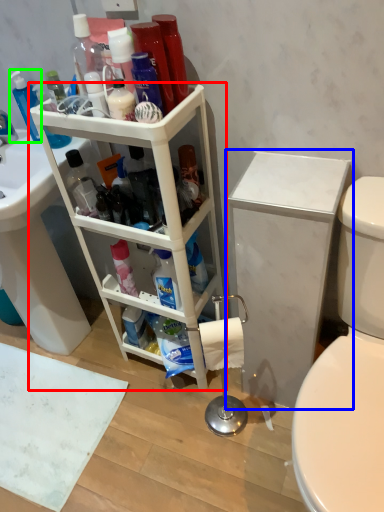
Question: Estimate the real-world distances between objects in this image. Which object is farther from shelf (highlighted by a red box), bathroom cabinet (highlighted by a blue box) or cleaning product (highlighted by a green box)?

Choices:
 (A) bathroom cabinet
 (B) cleaning product

Answer: (B)